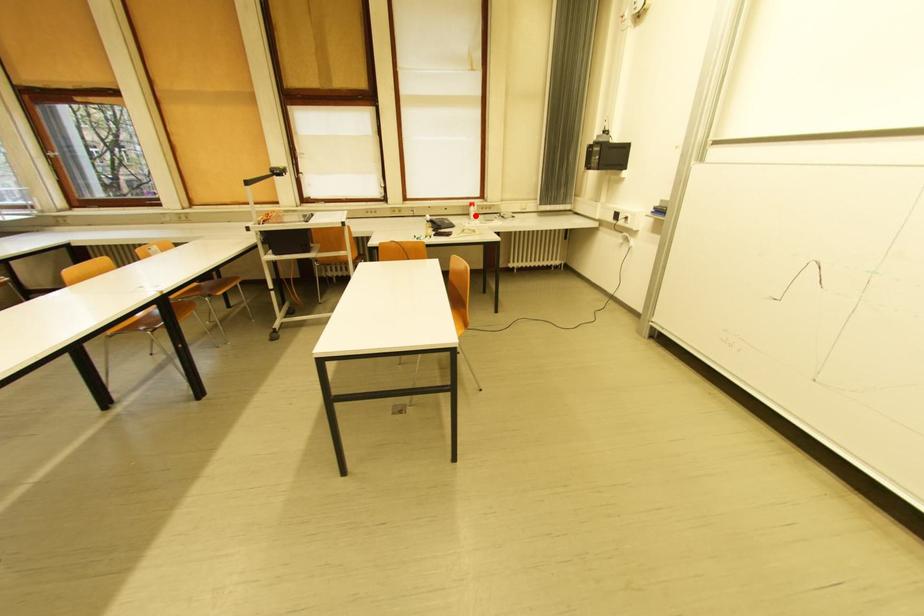
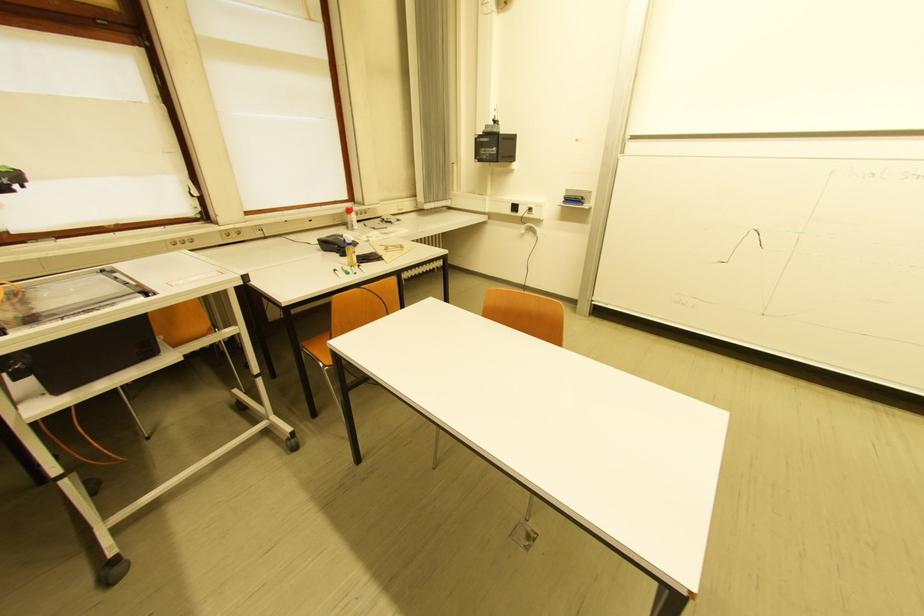
Where in the second image is the point corresponding to the highlighted location from the first image?

(351, 225)